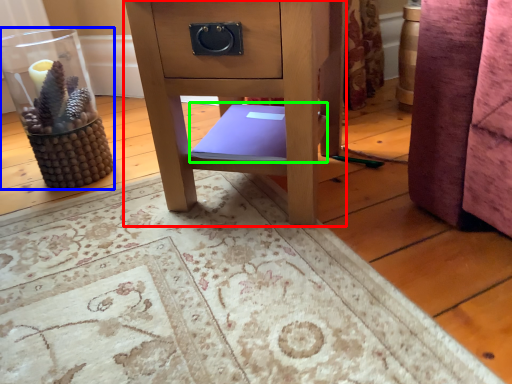
Question: Which is nearer to the furniture (highlighted by a red box)? glass vase (highlighted by a blue box) or book (highlighted by a green box).

Choices:
 (A) glass vase
 (B) book

Answer: (B)